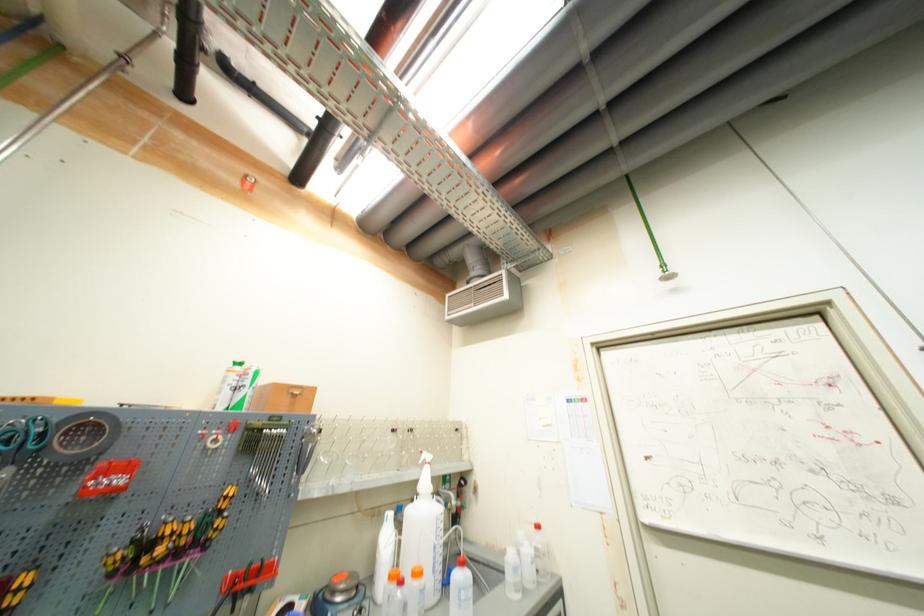
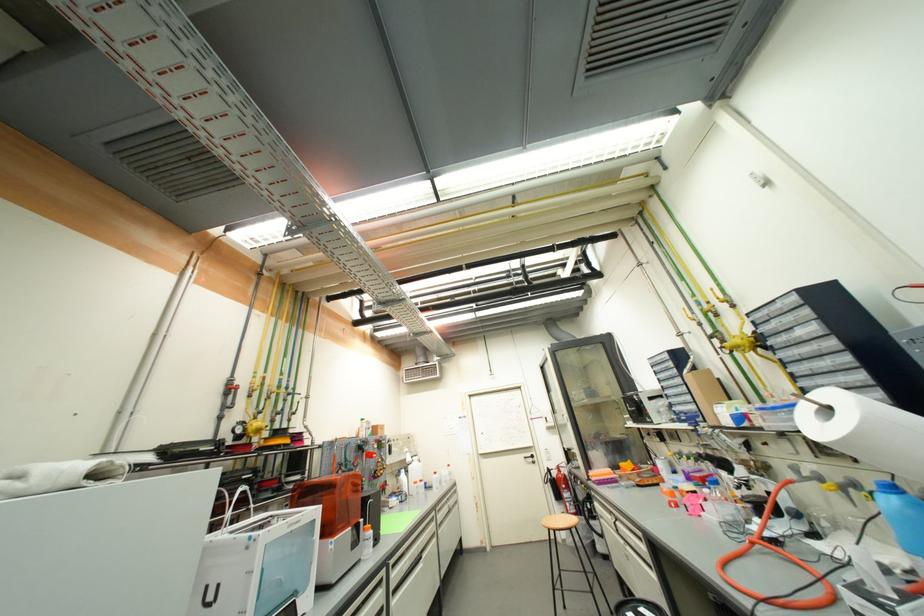
Where in the second image is the point corresponding to point (421, 484) from the first image?

(410, 461)